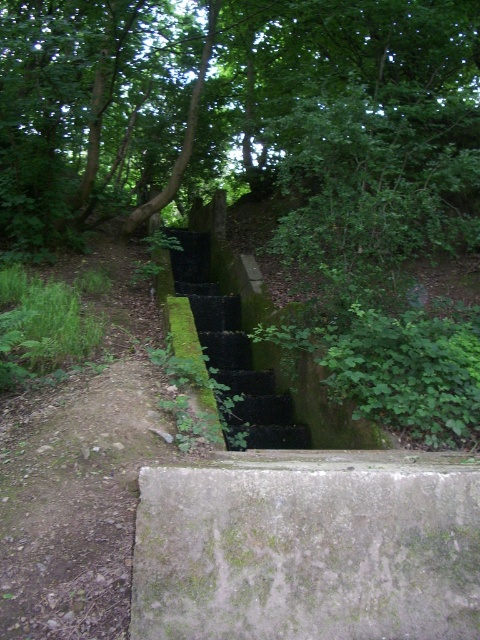
You are standing at the bottom of the steps and looking up. Which direction should you look to see the green leafy tree at upper center?

The green leafy tree at upper center is located at point (210, 96), so you should look upward and to the left to see it.

You are a hiker carrying a 2.5 meter long ladder. You need to place it between the green leafy tree at upper center and the green mossy concrete at center. Will the ladder fit horizontally between them?

The distance between the green leafy tree at upper center and the green mossy concrete at center is 6.35 meters. Since the ladder is only 2.5 meters long, it will fit horizontally between them with space to spare.

You are a hiker trying to locate the green mossy concrete at center. From your current position, which direction should you move relative to the green leafy tree at upper center to find it?

The green mossy concrete at center is behind the green leafy tree at upper center, so you should move behind the green leafy tree at upper center to find it.